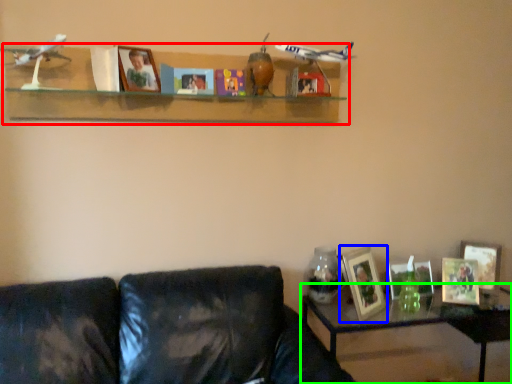
Question: Estimate the real-world distances between objects in this image. Which object is farther from shelf (highlighted by a red box), picture frame (highlighted by a blue box) or table (highlighted by a green box)?

Choices:
 (A) picture frame
 (B) table

Answer: (B)